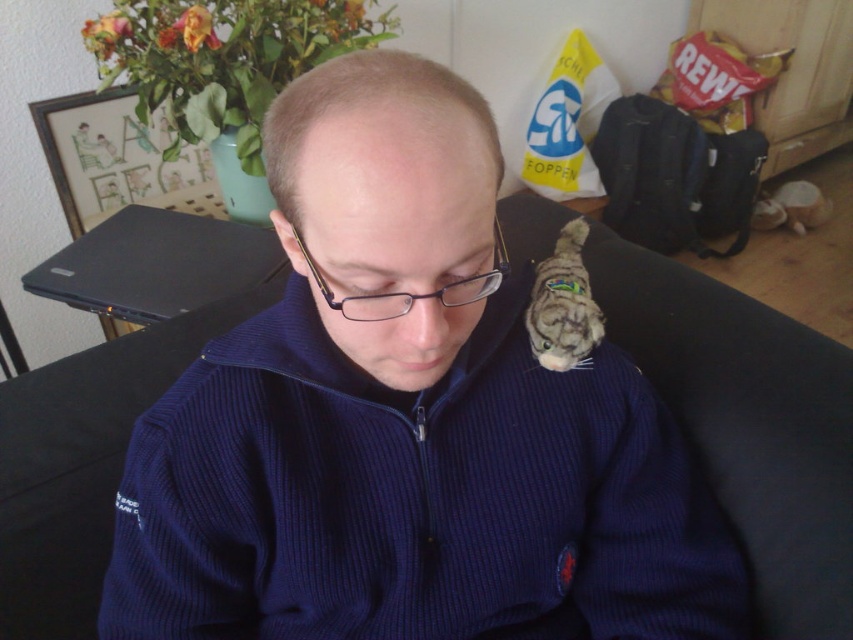
Please provide the coordinates of the blue corduroy head at center in the image. The coordinates should be in the format of a point with two decimal places, like this example format point 0.323, 0.455. Please answer using the following format, and do not add any other information besides the answer. Answer the question with as much accuracy as possible based on the information provided. Your answer should be like this example format point 0.323, 0.455. Answer the question with as much accuracy as possible.

point (x=387, y=205)

Based on the photo, you are a photographer trying to capture a closeup of the blue corduroy head at center and the navy corduroy sweater at center. Based on their positions, which one should you focus on first to ensure it appears sharp in the photo?

The blue corduroy head at center is behind the navy corduroy sweater at center, so you should focus on the navy corduroy sweater at center first to ensure it appears sharp before the background object.